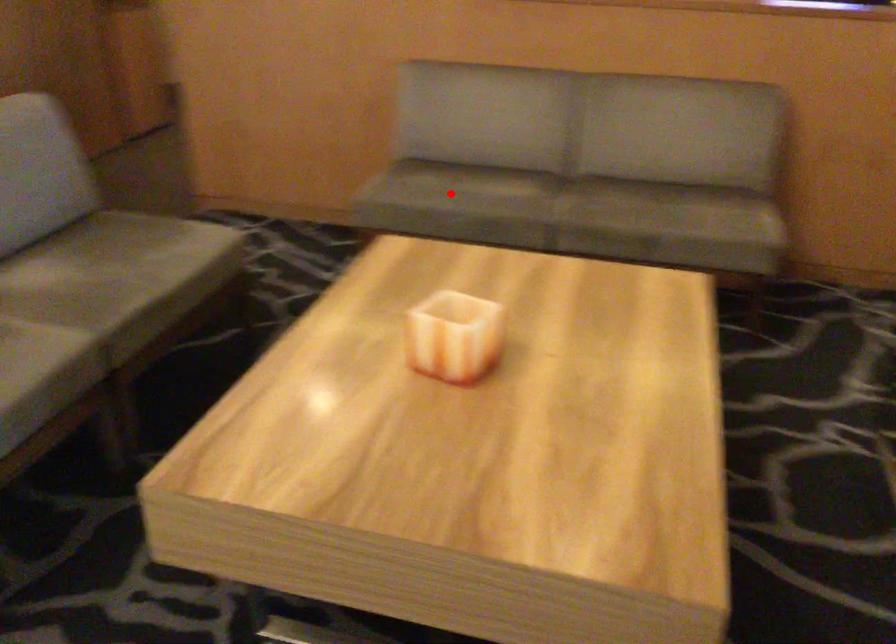
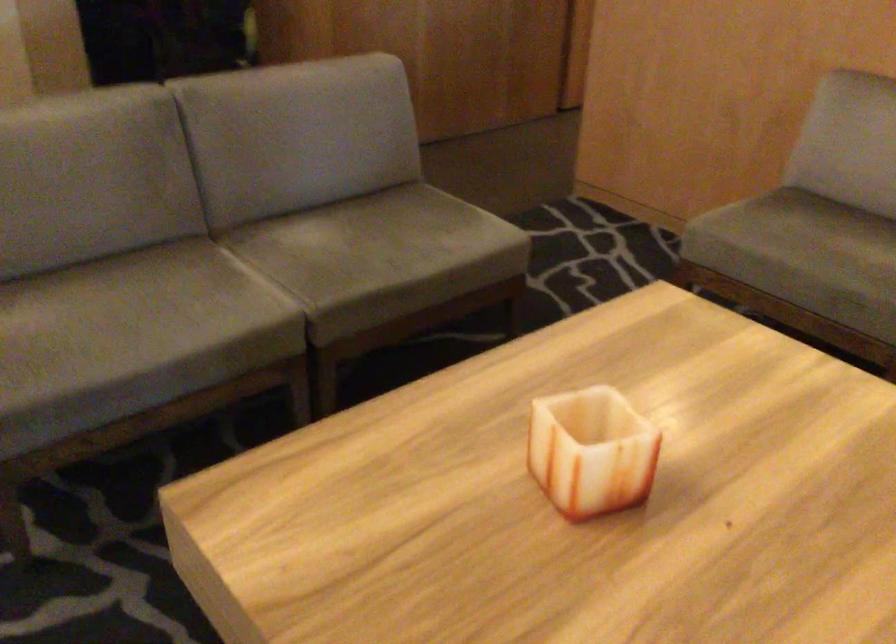
Question: I am providing you with two images of the same scene from different viewpoints. Given a red point in image1, look at the same physical point in image2. Is it:

Choices:
 (A) Closer to the viewpoint
 (B) Farther from the viewpoint

Answer: (A)